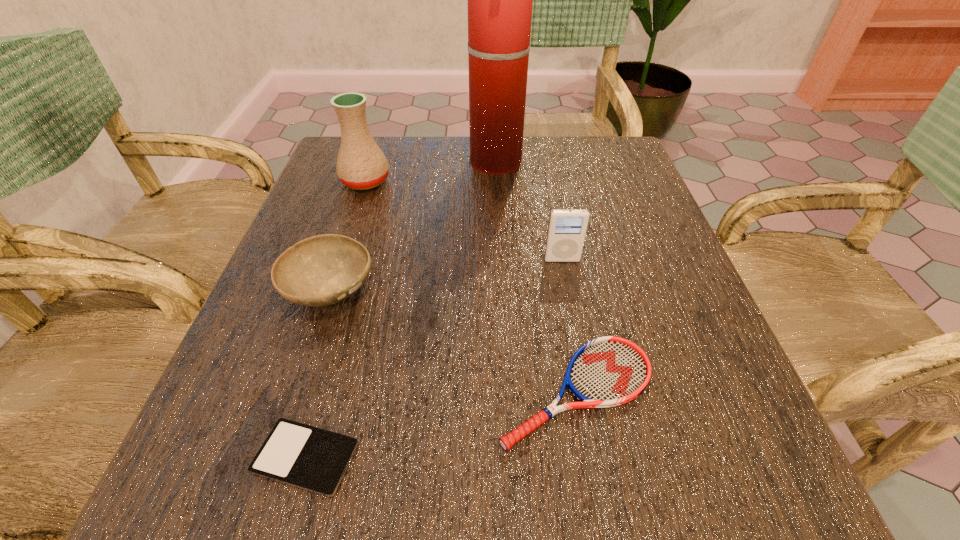
Identify the location of blank space at the right edge. This screenshot has height=540, width=960. (606, 307).

In the image, there is a desktop. Where is `vacant space at the far left corner`? vacant space at the far left corner is located at coordinates click(x=328, y=156).

You are a GUI agent. You are given a task and a screenshot of the screen. Output one action in this format:
    pyautogui.click(x=<x>, y=<y>)
    Task: Click on the vacant space at the near left corner of the desktop
    Image resolution: width=960 pixels, height=540 pixels.
    Given the screenshot: What is the action you would take?
    pyautogui.click(x=220, y=511)

Find the location of a particular element. The height and width of the screenshot is (540, 960). blank space at the far right corner is located at coordinates (623, 137).

Locate an element on the screen. Image resolution: width=960 pixels, height=540 pixels. blank space at the near right corner of the desktop is located at coordinates 792,500.

Find the location of a particular element. The image size is (960, 540). free area in between the right iPod and the nearer iPod is located at coordinates (434, 359).

This screenshot has width=960, height=540. What are the coordinates of `unoccupied area between the taller iPod and the bowl` in the screenshot? It's located at (445, 274).

You are a GUI agent. You are given a task and a screenshot of the screen. Output one action in this format:
    pyautogui.click(x=<x>, y=<y>)
    Task: Click on the unoccupied area between the second tallest object and the shorter iPod
    This screenshot has width=960, height=540.
    Given the screenshot: What is the action you would take?
    pyautogui.click(x=336, y=319)

This screenshot has width=960, height=540. What are the coordinates of `blank region between the tallest object and the bowl` in the screenshot? It's located at (413, 226).

The height and width of the screenshot is (540, 960). Identify the location of vacant area between the tennis racket and the third shortest object. (453, 340).